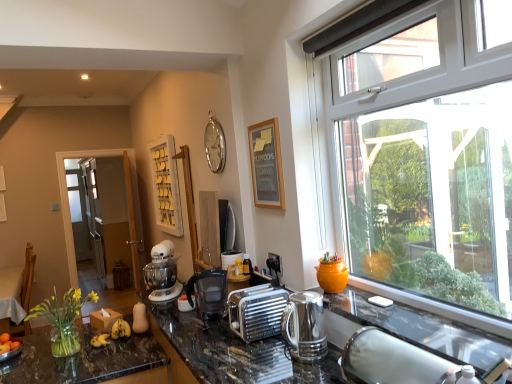
Question: Do you think silver metallic toaster at center, which is the first appliance in bottom-to-top order, is within wooden chair at left, or outside of it?

Choices:
 (A) inside
 (B) outside

Answer: (B)

Question: Is silver metallic toaster at center, the first appliance positioned from the front, to the left or to the right of wooden chair at left in the image?

Choices:
 (A) left
 (B) right

Answer: (B)

Question: Which object is positioned farthest from the black plastic coffee machine at center, which is the first coffee machine from back to front?

Choices:
 (A) wooden picture frame at upper center
 (B) white wooden shelf at upper center
 (C) orange matte bowl at lower left
 (D) polished stainless steel kettle at lower right, arranged as the second coffee machine when viewed from the left
 (E) silver metallic clock at upper center

Answer: (B)

Question: Considering the real-world distances, which object is farthest from the wooden picture frame at upper center?

Choices:
 (A) polished granite countertop at center
 (B) metallic silver toaster at center, which ranks as the 1th appliance in back-to-front order
 (C) translucent glass countertop at lower left
 (D) silver metallic toaster at center, the first appliance positioned from the front
 (E) white plastic window at right

Answer: (C)